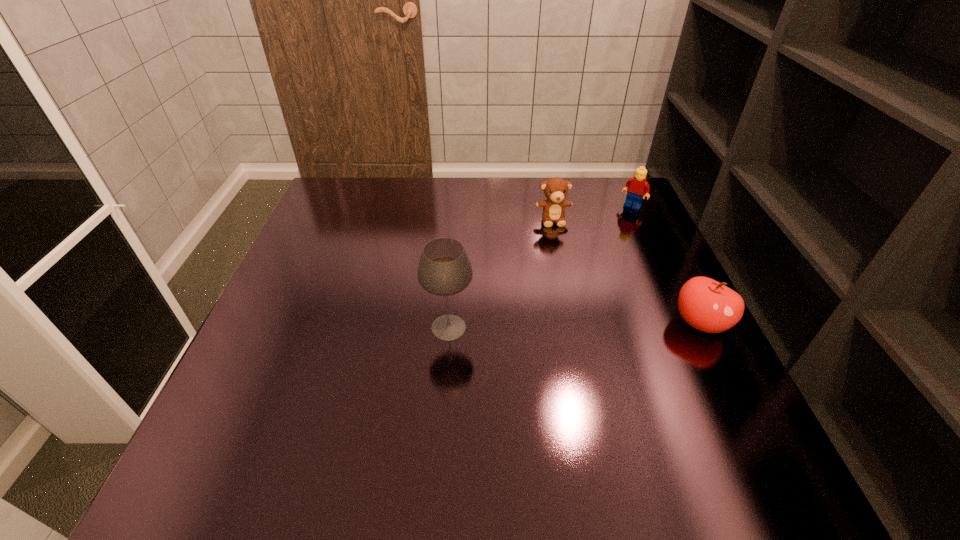
In the image, there is a desktop. Where is `vacant space at the near edge`? Image resolution: width=960 pixels, height=540 pixels. vacant space at the near edge is located at coordinates (432, 419).

The image size is (960, 540). Find the location of `free space at the left edge`. free space at the left edge is located at coordinates click(287, 372).

Where is `free location at the right edge of the desktop`? free location at the right edge of the desktop is located at coordinates (645, 371).

Find the location of a particular element. free space at the far left corner of the desktop is located at coordinates click(x=353, y=197).

Find the location of a particular element. blank space at the near left corner of the desktop is located at coordinates (278, 428).

In the image, there is a desktop. Identify the location of vacant space at the near right corner. (663, 411).

What are the coordinates of `free space between the farthest object and the apple` in the screenshot? It's located at (666, 265).

Identify the location of free spot between the second object from left to right and the Lego. This screenshot has height=540, width=960. (592, 213).

You are a GUI agent. You are given a task and a screenshot of the screen. Output one action in this format:
    pyautogui.click(x=<x>, y=<y>)
    Task: Click on the unoccupied area between the apple and the leftmost object
    Image resolution: width=960 pixels, height=540 pixels.
    Given the screenshot: What is the action you would take?
    pyautogui.click(x=575, y=325)

At what (x,y) coordinates should I click in order to perform the action: click on vacant space in between the second farthest object and the leftmost object. Please return your answer as a coordinate pair (x, y). Looking at the image, I should click on (501, 274).